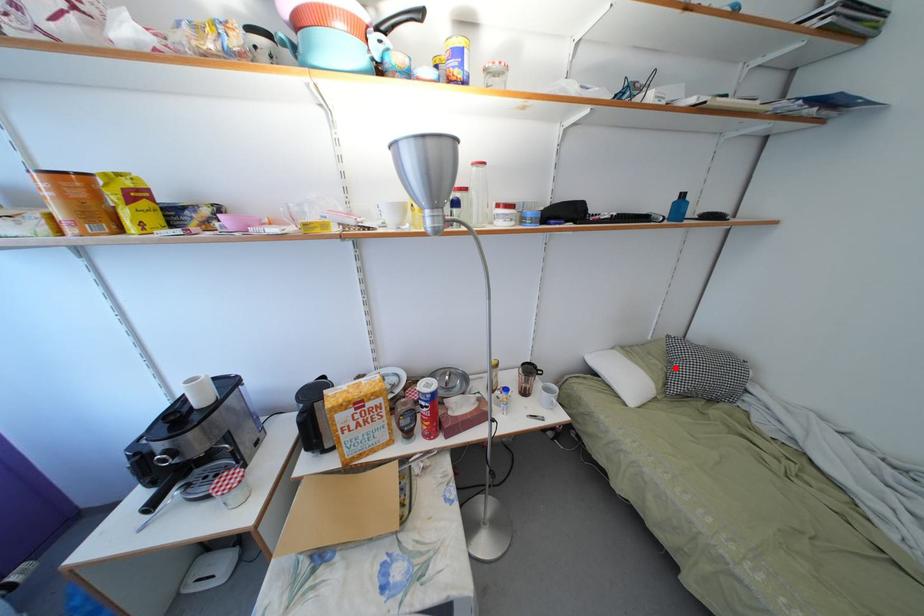
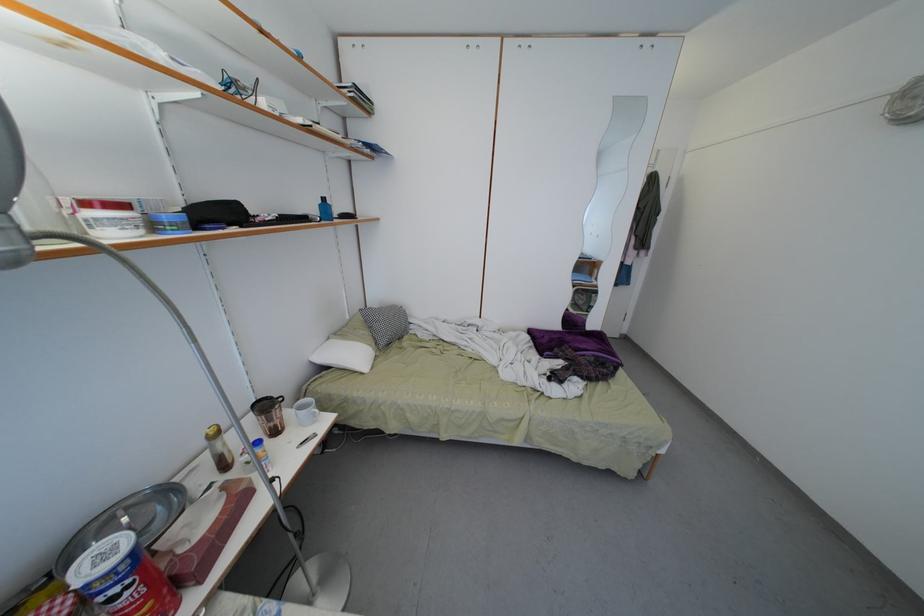
Where in the second image is the point corresponding to the highlighted location from the first image?

(375, 333)